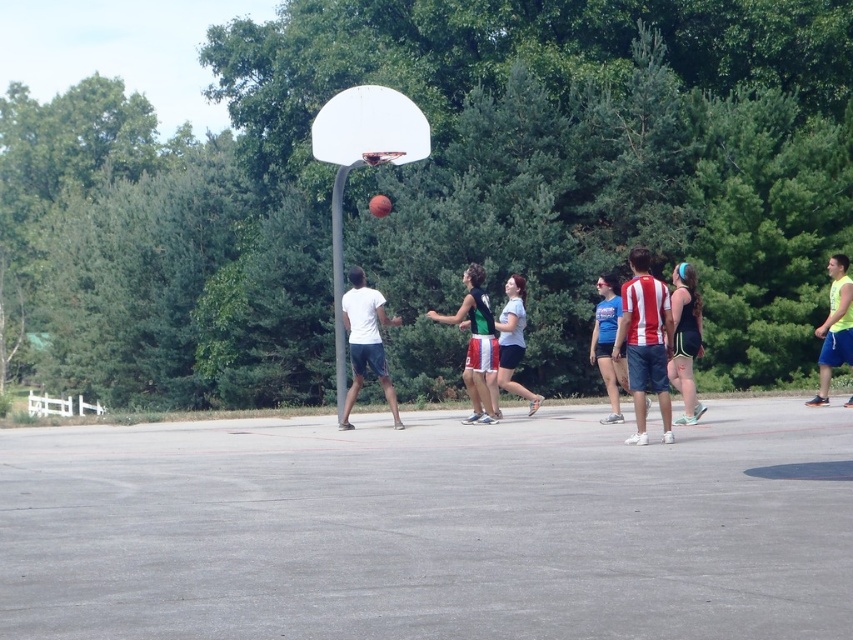
Question: Does white matte basketball hoop at center have a greater width compared to light blue t-shirt at center?

Choices:
 (A) no
 (B) yes

Answer: (B)

Question: Does matte black tank top at center have a smaller size compared to yellow matte tank top at right?

Choices:
 (A) no
 (B) yes

Answer: (B)

Question: From the image, what is the correct spatial relationship of green jersey at center in relation to light blue t-shirt at center?

Choices:
 (A) above
 (B) below

Answer: (B)

Question: Among these objects, which one is nearest to the camera?

Choices:
 (A) light blue t-shirt at center
 (B) matte black tank top at center

Answer: (B)

Question: Which point is farther to the camera?

Choices:
 (A) (830, 294)
 (B) (376, 301)
 (C) (378, 205)
 (D) (514, 381)

Answer: (D)

Question: Among these points, which one is nearest to the camera?

Choices:
 (A) (848, 310)
 (B) (482, 419)

Answer: (A)